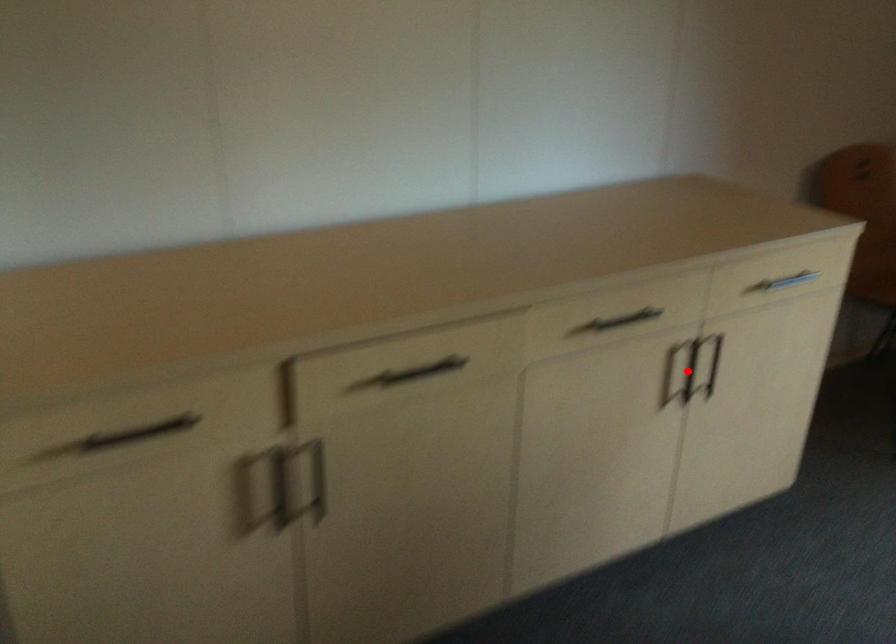
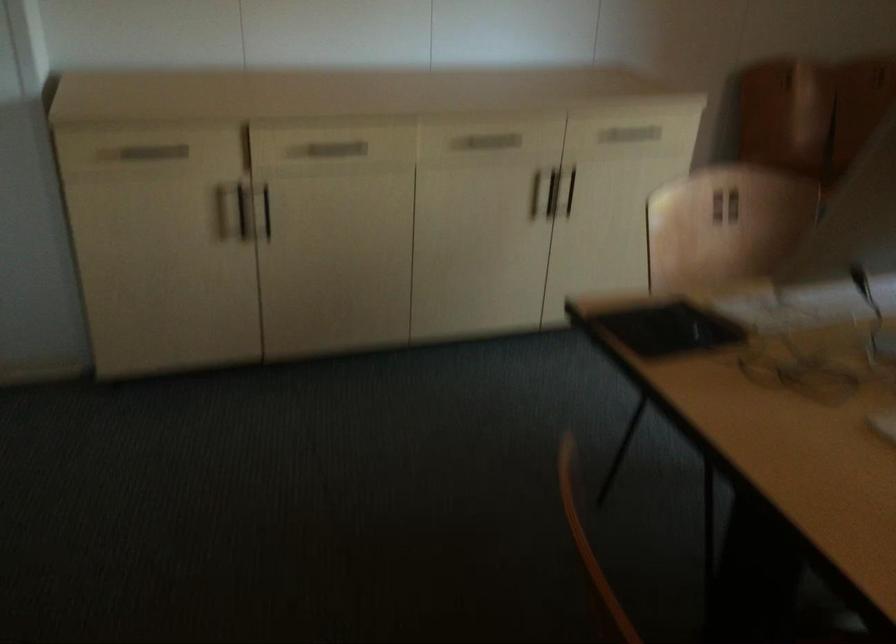
Question: I am providing you with two images of the same scene from different viewpoints. A red point is shown in image1. For the corresponding object point in image2, is it positioned nearer or farther from the camera?

Choices:
 (A) Nearer
 (B) Farther

Answer: (B)